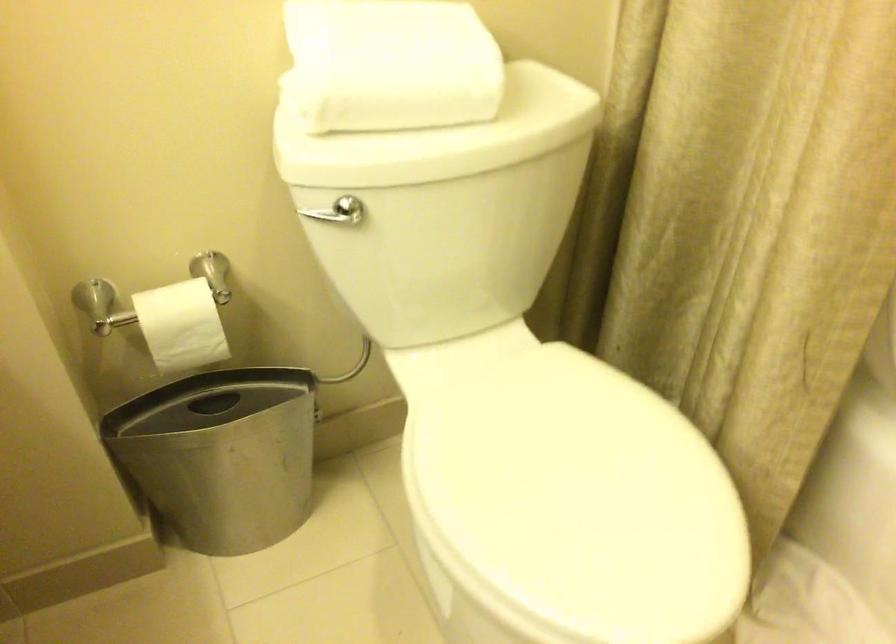
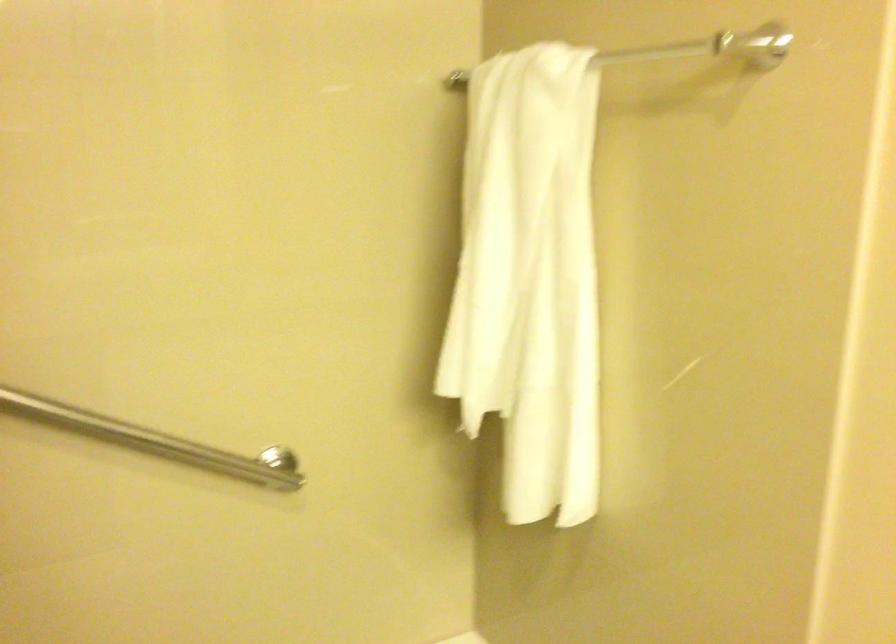
Question: The camera is either moving clockwise (left) or counter-clockwise (right) around the object. The first image is from the beginning of the video and the second image is from the end. Is the camera moving left or right when shooting the video?

Choices:
 (A) Left
 (B) Right

Answer: (A)